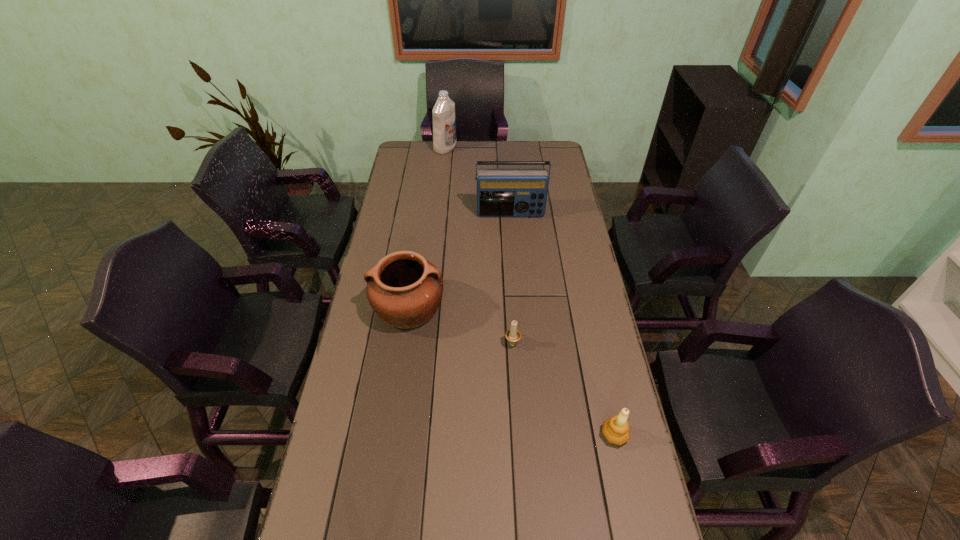
You are a GUI agent. You are given a task and a screenshot of the screen. Output one action in this format:
    pyautogui.click(x=<x>, y=<y>)
    Task: Click on the free space located on the front panel of the fourth nearest object
    The height and width of the screenshot is (540, 960).
    Given the screenshot: What is the action you would take?
    pyautogui.click(x=514, y=254)

I want to click on free space located 0.200m on the front of the third tallest object, so click(x=396, y=394).

What are the coordinates of `free space located 0.180m on the front of the taller candle_holder` in the screenshot? It's located at (634, 524).

Identify the location of vacant area situated on the handle side of the left candle_holder. This screenshot has width=960, height=540. (511, 315).

Locate an element on the screen. The height and width of the screenshot is (540, 960). vacant space located 0.210m on the handle side of the left candle_holder is located at coordinates (509, 287).

The image size is (960, 540). I want to click on free point located 0.100m on the handle side of the left candle_holder, so click(x=511, y=310).

Locate an element on the screen. This screenshot has height=540, width=960. object that is at the far edge is located at coordinates (444, 121).

You are a GUI agent. You are given a task and a screenshot of the screen. Output one action in this format:
    pyautogui.click(x=<x>, y=<y>)
    Task: Click on the object that is at the left edge
    The image size is (960, 540).
    Given the screenshot: What is the action you would take?
    pyautogui.click(x=404, y=289)

You are a GUI agent. You are given a task and a screenshot of the screen. Output one action in this format:
    pyautogui.click(x=<x>, y=<y>)
    Task: Click on the radio receiver that is at the right edge
    The width and height of the screenshot is (960, 540).
    Given the screenshot: What is the action you would take?
    coord(500,192)

The width and height of the screenshot is (960, 540). I want to click on candle_holder present at the right edge, so tap(616, 430).